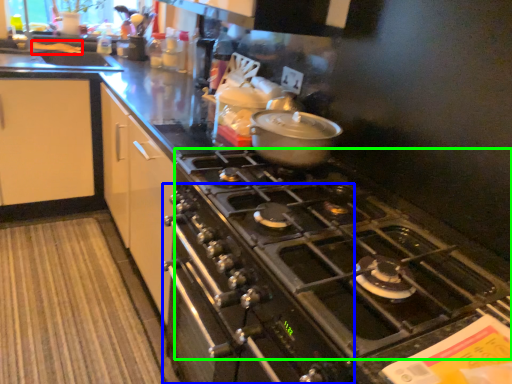
Question: Which is farther away from food (highlighted by a red box)? oven (highlighted by a blue box) or gas stove (highlighted by a green box)?

Choices:
 (A) oven
 (B) gas stove

Answer: (B)